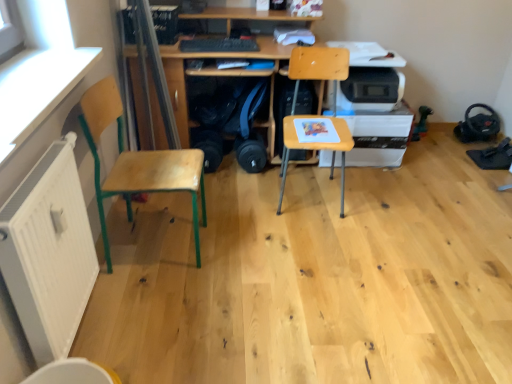
This screenshot has width=512, height=384. In order to click on vacant area in front of wooden chair at center, arranged as the first chair when viewed from the right in this screenshot , I will do `click(313, 234)`.